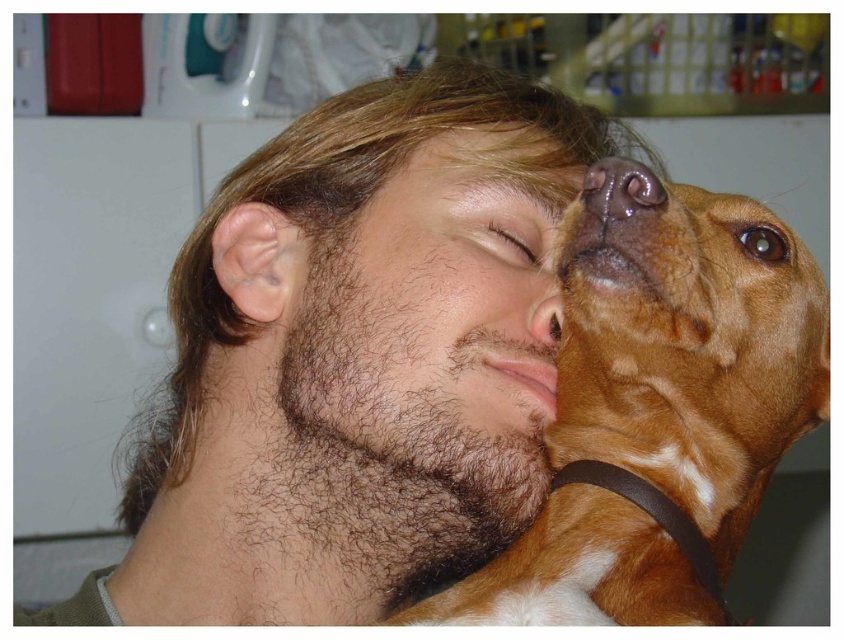
Question: Is brown leather dog at center wider than brown hairy face at center?

Choices:
 (A) no
 (B) yes

Answer: (B)

Question: Does brown matte eye at center have a smaller size compared to brown glossy eye at upper right?

Choices:
 (A) no
 (B) yes

Answer: (A)

Question: Which object is farther from the camera taking this photo?

Choices:
 (A) brown glossy eye at upper right
 (B) shiny brown nose at center
 (C) brown hairy face at center

Answer: (C)

Question: Is brown leather dog at center in front of brown hairy face at center?

Choices:
 (A) yes
 (B) no

Answer: (A)

Question: Based on their relative distances, which object is nearer to the brown hairy face at center?

Choices:
 (A) brown matte dog nose at upper center
 (B) brown matte eye at center
 (C) brown leather dog at center

Answer: (B)

Question: Which of the following is the farthest from the observer?

Choices:
 (A) brown hairy face at center
 (B) brown matte eye at center

Answer: (B)